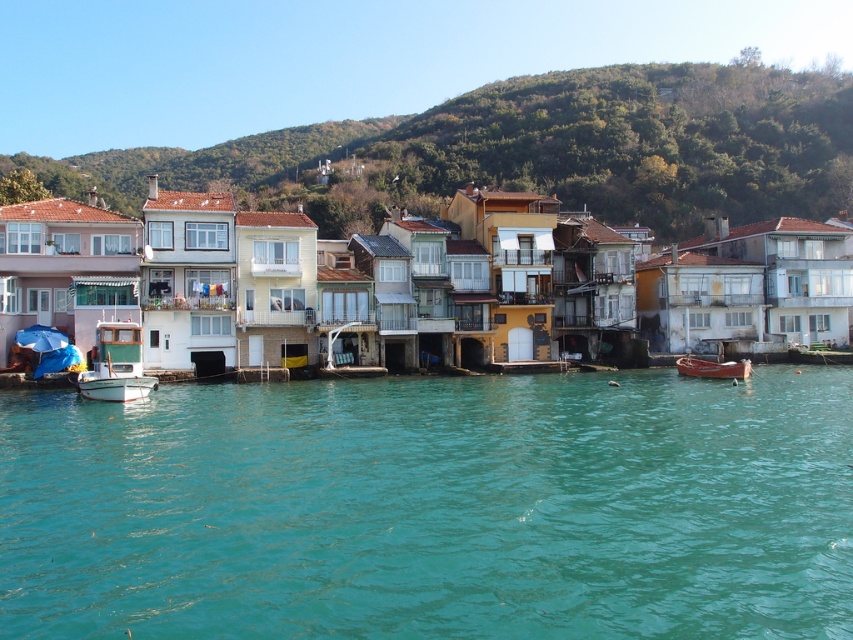
You are standing at the water edge in the coastal scene. Looking towards the green leafy hillside at upper center, which direction should you face to see the point marked at coordinate (538, 148)?

The point at coordinate (538, 148) corresponds to the green leafy hillside at upper center, so you should face upwards to see it.

You are an artist planning to paint the coastal scene. You want to ensure the teal glossy water at center and the green leafy hillside at upper center are proportionally accurate. Which of these two elements should you paint to take up more space on your canvas?

The green leafy hillside at upper center should take up more space on the canvas because it occupies more space than the teal glossy water at center in the scene.

You are a tourist standing on the shore looking at the teal glossy water at center and the wooden boat at lower right. Which object is closer to the water?

The wooden boat at lower right is closer to the teal glossy water at center because it is positioned over it.